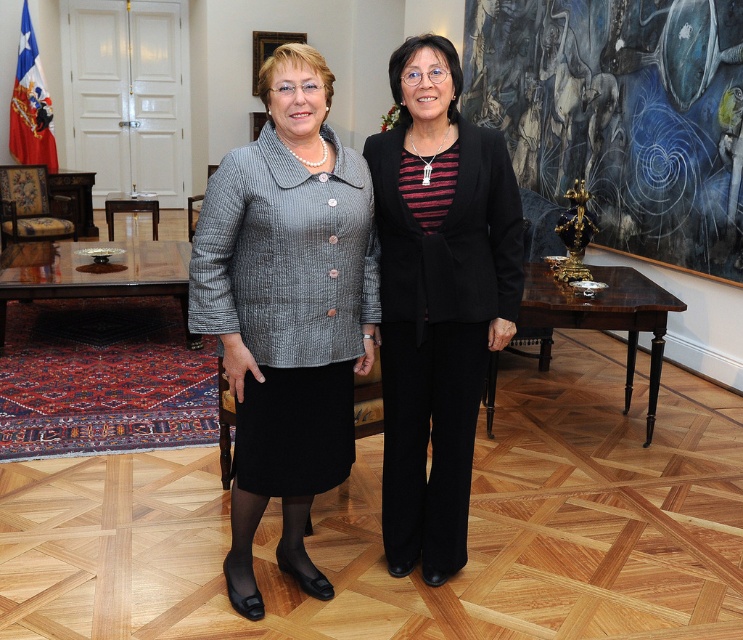
Who is higher up, matte gray blazer at center or black textured pants at center?

black textured pants at center is above.

Can you confirm if matte gray blazer at center is positioned to the right of black textured pants at center?

No, matte gray blazer at center is not to the right of black textured pants at center.

The height and width of the screenshot is (640, 743). Find the location of `matte gray blazer at center`. matte gray blazer at center is located at coordinates (288, 310).

At what (x,y) coordinates should I click in order to perform the action: click on matte gray blazer at center. Please return your answer as a coordinate pair (x, y). This screenshot has width=743, height=640. Looking at the image, I should click on (288, 310).

Does metallic gold sculpture at right have a smaller size compared to black textured pants at center?

No.

Can you confirm if metallic gold sculpture at right is wider than black textured pants at center?

Yes, metallic gold sculpture at right is wider than black textured pants at center.

Is point (730, 237) closer to camera compared to point (450, 220)?

No, (730, 237) is further to viewer.

This screenshot has width=743, height=640. I want to click on metallic gold sculpture at right, so point(620,115).

Consider the image. Is matte gray blazer at center shorter than metallic gold sculpture at right?

Yes, matte gray blazer at center is shorter than metallic gold sculpture at right.

Locate an element on the screen. This screenshot has width=743, height=640. matte gray blazer at center is located at coordinates (288, 310).